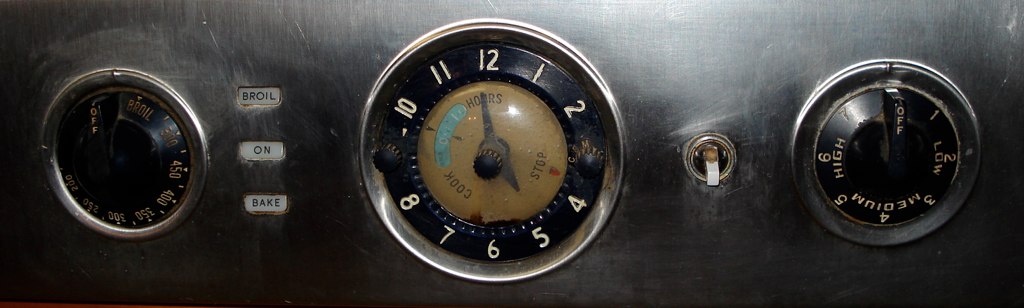
Where is `temperature knob`? temperature knob is located at coordinates (102, 148).